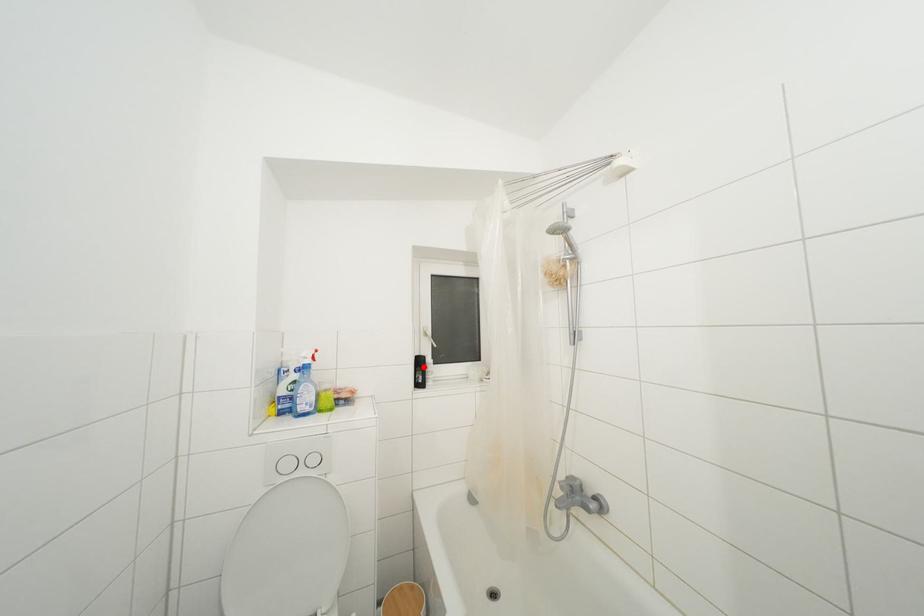
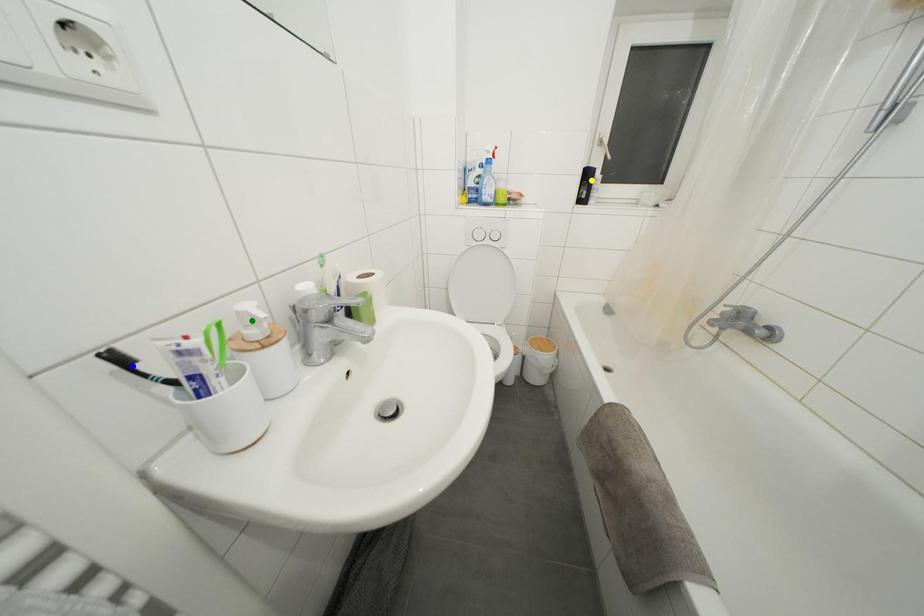
Question: I am providing you with two images of the same scene from different viewpoints. A red point is marked on the first image. You are given multiple points on the second image. In image 2, which mark is for the same physical point as the one in image 1?

Choices:
 (A) blue point
 (B) yellow point
 (C) green point

Answer: (B)